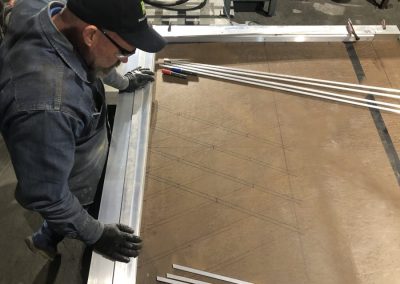
The height and width of the screenshot is (284, 400). I want to click on black frames, so click(x=121, y=48).